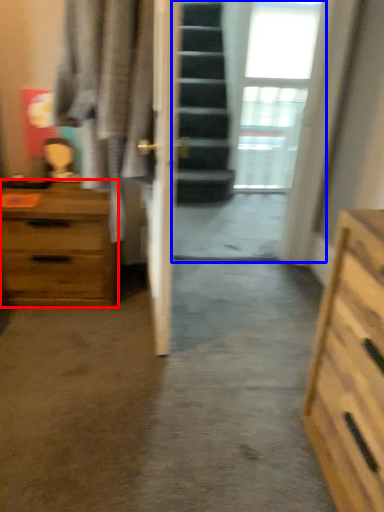
Question: Among these objects, which one is nearest to the camera, chest of drawers (highlighted by a red box) or glass door (highlighted by a blue box)?

Choices:
 (A) chest of drawers
 (B) glass door

Answer: (A)